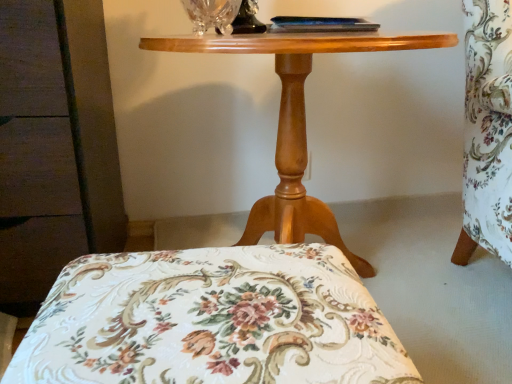
Question: From a real-world perspective, is floral fabric cushion at center above or below transparent crystal vase at upper center?

Choices:
 (A) below
 (B) above

Answer: (A)

Question: From the image's perspective, is floral fabric cushion at center located above or below transparent crystal vase at upper center?

Choices:
 (A) above
 (B) below

Answer: (B)

Question: Based on their relative distances, which object is farther from the floral fabric cushion at center?

Choices:
 (A) wooden table at center
 (B) transparent crystal vase at upper center
 (C) clear glass table lamp at upper center

Answer: (C)

Question: Based on their relative distances, which object is nearer to the floral fabric cushion at center?

Choices:
 (A) transparent crystal vase at upper center
 (B) clear glass table lamp at upper center
 (C) wooden table at center

Answer: (C)